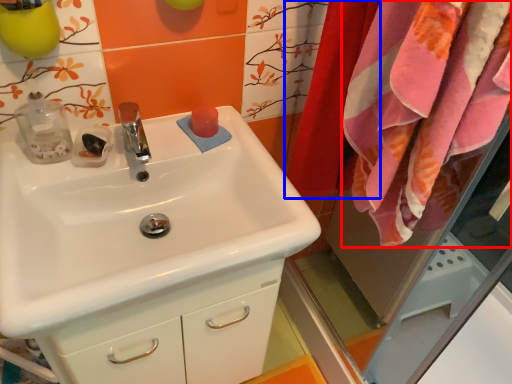
Question: Which point is closer to the camera, bath towel (highlighted by a red box) or curtain (highlighted by a blue box)?

Choices:
 (A) bath towel
 (B) curtain

Answer: (A)